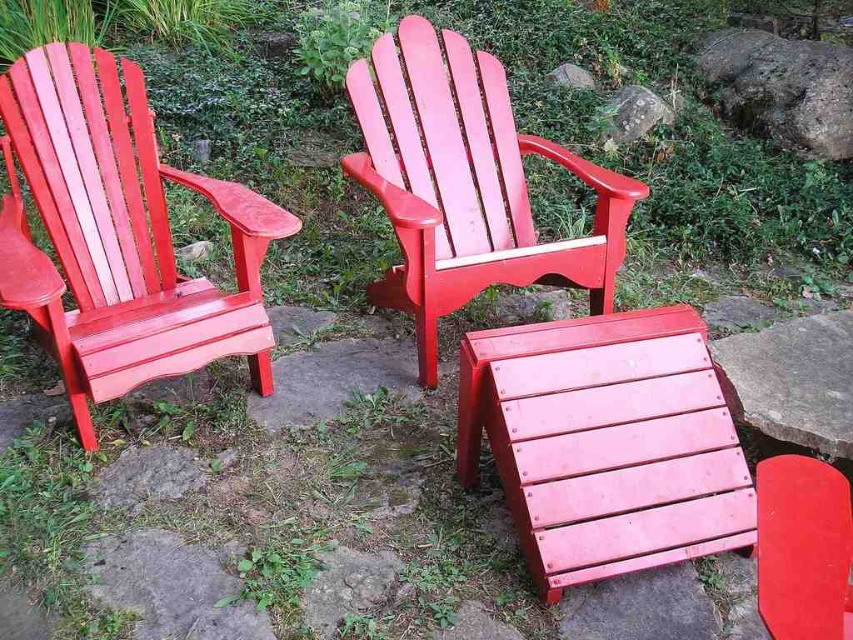
Does matte wood chair at left have a smaller size compared to gray rough rock at upper right?

No.

What do you see at coordinates (119, 234) in the screenshot?
I see `matte wood chair at left` at bounding box center [119, 234].

This screenshot has width=853, height=640. Identify the location of matte wood chair at left. (119, 234).

You are a GUI agent. You are given a task and a screenshot of the screen. Output one action in this format:
    pyautogui.click(x=<x>, y=<y>)
    Task: Click on the matte wood chair at left
    The image size is (853, 640).
    Given the screenshot: What is the action you would take?
    pyautogui.click(x=119, y=234)

From the picture: Can you confirm if smooth gray stone at center is shorter than smooth gray rock at upper center?

No.

What do you see at coordinates (792, 380) in the screenshot? The height and width of the screenshot is (640, 853). I see `smooth gray stone at center` at bounding box center [792, 380].

Is point (718, 380) closer to viewer compared to point (660, 113)?

Yes, it is.

Image resolution: width=853 pixels, height=640 pixels. What are the coordinates of `smooth gray stone at center` in the screenshot? It's located at (792, 380).

Does matte wood chair at left have a lesser height compared to smooth gray rock at upper center?

Incorrect, matte wood chair at left's height does not fall short of smooth gray rock at upper center's.

Who is more forward, [262,376] or [614,145]?

Positioned in front is point [262,376].

Where is `matte wood chair at left`? Image resolution: width=853 pixels, height=640 pixels. matte wood chair at left is located at coordinates (119, 234).